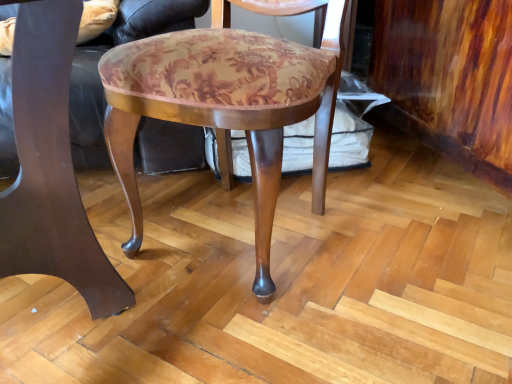
What are the coordinates of `free point in front of wooden chair at center, the first chair when ordered from right to left` in the screenshot? It's located at (288, 331).